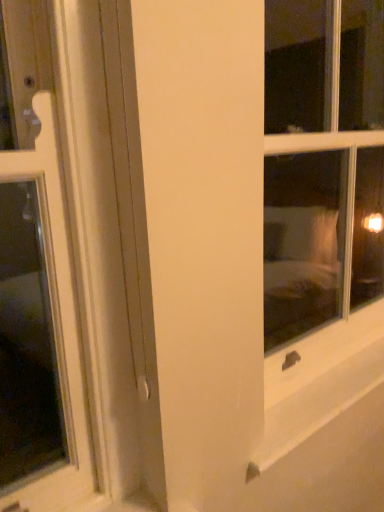
The image size is (384, 512). I want to click on white matte window sill at lower right, so click(x=307, y=415).

Describe the element at coordinates (307, 415) in the screenshot. This screenshot has height=512, width=384. I see `white matte window sill at lower right` at that location.

Locate an element on the screen. white matte window sill at lower right is located at coordinates (307, 415).